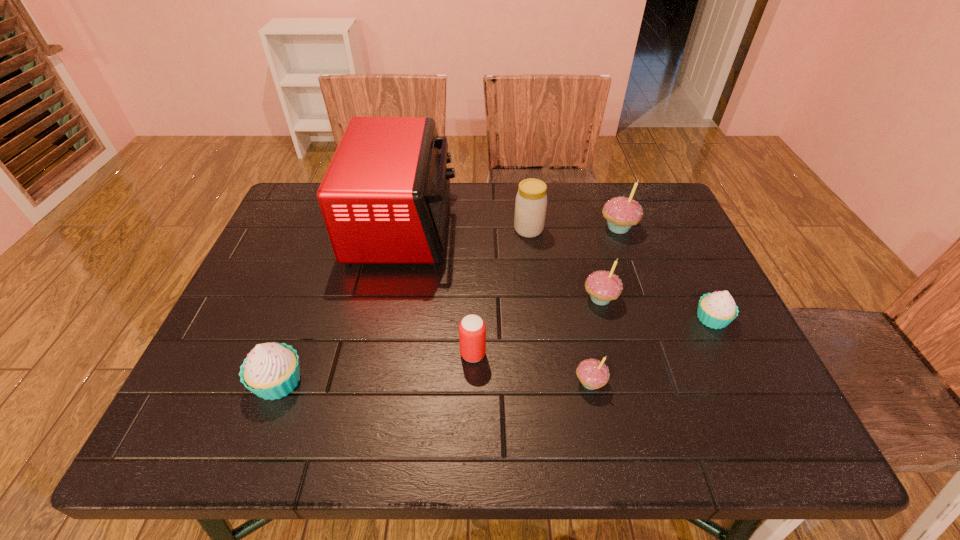
Image resolution: width=960 pixels, height=540 pixels. What are the coordinates of `the farther white cupcake` in the screenshot? It's located at (716, 310).

Locate an element on the screen. This screenshot has height=540, width=960. the right white cupcake is located at coordinates (716, 310).

Locate an element on the screen. the nearest pink cupcake is located at coordinates (593, 374).

Identify the location of vacant space situated 0.310m on the front-facing side of the toaster oven. (564, 225).

Image resolution: width=960 pixels, height=540 pixels. In order to click on vacant space located on the front of the rightmost pink cupcake in this screenshot , I will do `click(637, 282)`.

Locate an element on the screen. The width and height of the screenshot is (960, 540). vacant area situated 0.140m on the right of the jar is located at coordinates (593, 230).

You are a GUI agent. You are given a task and a screenshot of the screen. Output one action in this format:
    pyautogui.click(x=<x>, y=<y>)
    Task: Click on the free space located 0.120m on the front of the second biggest pink cupcake
    This screenshot has height=540, width=960.
    Given the screenshot: What is the action you would take?
    pyautogui.click(x=615, y=355)

You are a GUI agent. You are given a task and a screenshot of the screen. Output one action in this format:
    pyautogui.click(x=<x>, y=<y>)
    Task: Click on the free space located on the back of the bigger white cupcake
    This screenshot has width=960, height=540.
    Given the screenshot: What is the action you would take?
    pyautogui.click(x=310, y=296)

What are the coordinates of `vacant space located on the back of the beer can` in the screenshot? It's located at (473, 306).

Find the location of a particular element. Image resolution: width=960 pixels, height=540 pixels. free space located 0.340m on the back of the right white cupcake is located at coordinates (663, 217).